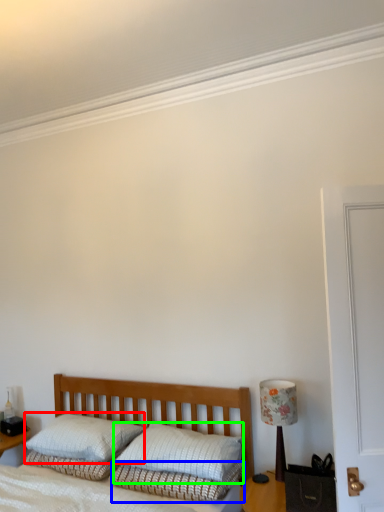
Question: Estimate the real-world distances between objects in this image. Which object is farther from pillow (highlighted by a red box), bedding (highlighted by a blue box) or pillow (highlighted by a green box)?

Choices:
 (A) bedding
 (B) pillow

Answer: (A)